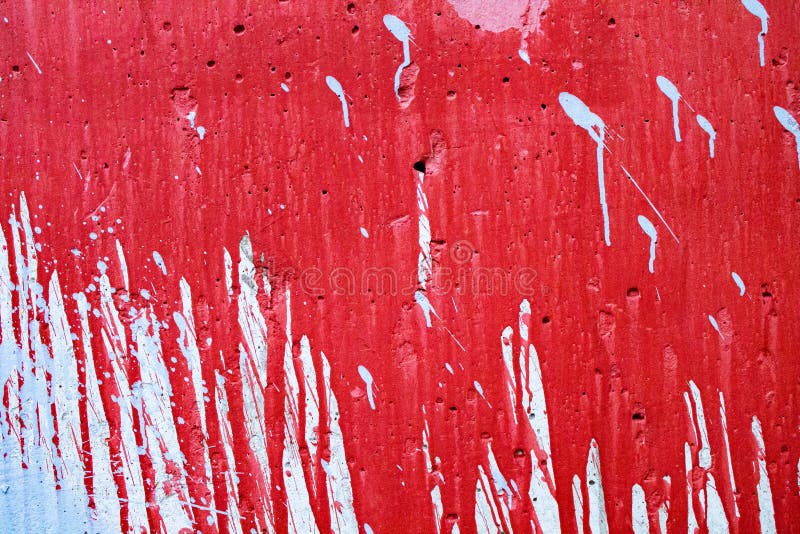
Locate an element on the screen. red paint is located at coordinates (304, 124), (481, 131), (574, 202), (722, 214).